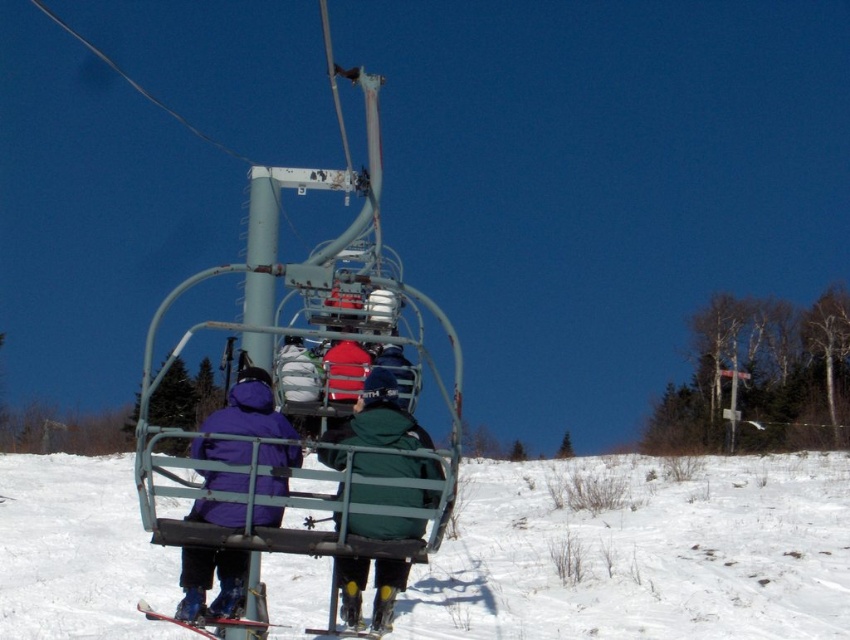
You are standing at the base of the ski resort and want to reach a specific point marked at coordinates point (375, 454). If your maximum comfortable walking distance is 25 feet, can you comfortably walk to that point without needing assistance?

The distance of point (375, 454) from viewer is 27.10 feet, which exceeds your maximum comfortable walking distance of 25 feet. Therefore, you may need assistance or a different route to reach that point.

You are standing at the base of the ski resort and looking up at the ski lift. Which direction should you look to see the purple fleece jacket at left?

The purple fleece jacket at left is located at point 0.912 on the x axis and 0.249 on the y axis. Since the x coordinate is closer to 1, it is positioned to the right side of the image. The y coordinate is closer to 0.25, meaning it is lower in the image. Therefore, you should look to the right and slightly downward to see the purple fleece jacket at left.

You are a photographer trying to capture a photo of the purple fleece jacket at left and the matte black ski at lower center. Based on their sizes in the image, which object would appear taller in the photo?

The purple fleece jacket at left appears taller than the matte black ski at lower center in the photo.